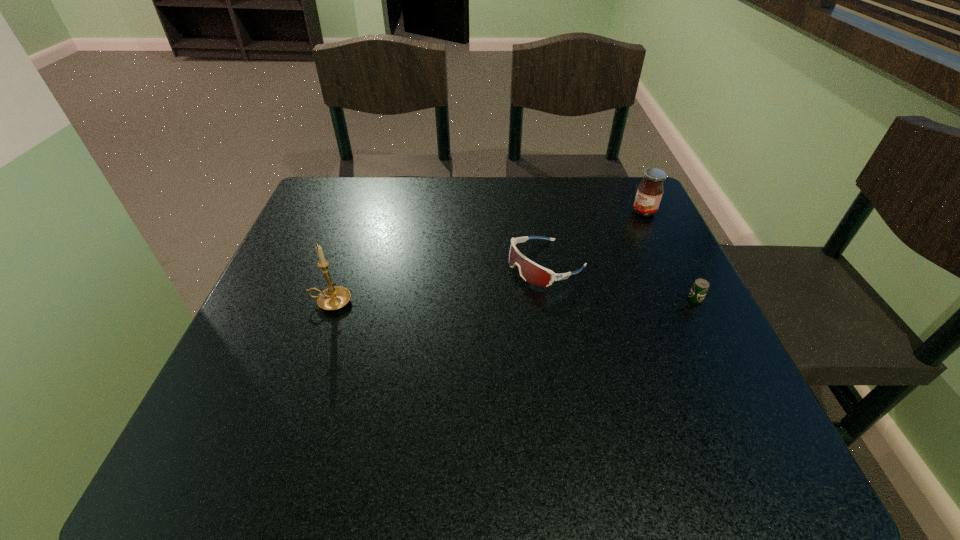
Find the location of a particular element. This screenshot has width=960, height=540. vacant point at the near edge is located at coordinates (599, 393).

In the image, there is a desktop. At what (x,y) coordinates should I click in order to perform the action: click on vacant space at the left edge. Please return your answer as a coordinate pair (x, y). Looking at the image, I should click on 331,238.

In the image, there is a desktop. Where is `vacant space at the right edge`? The image size is (960, 540). vacant space at the right edge is located at coordinates (624, 268).

This screenshot has height=540, width=960. I want to click on vacant space at the far left corner of the desktop, so click(358, 197).

Identify the location of free location at the near left corner of the desktop. This screenshot has height=540, width=960. (272, 384).

In the image, there is a desktop. What are the coordinates of `vacant space at the far right corner` in the screenshot? It's located at (600, 205).

Identify the location of vacant region at the near right corner of the desktop. The image size is (960, 540). (744, 396).

The image size is (960, 540). I want to click on vacant point located between the third tallest object and the tallest object, so click(439, 283).

In order to click on empty space between the shortest object and the candle holder in this screenshot , I will do `click(513, 301)`.

Where is `free space between the beer can and the jam`? This screenshot has height=540, width=960. free space between the beer can and the jam is located at coordinates (670, 255).